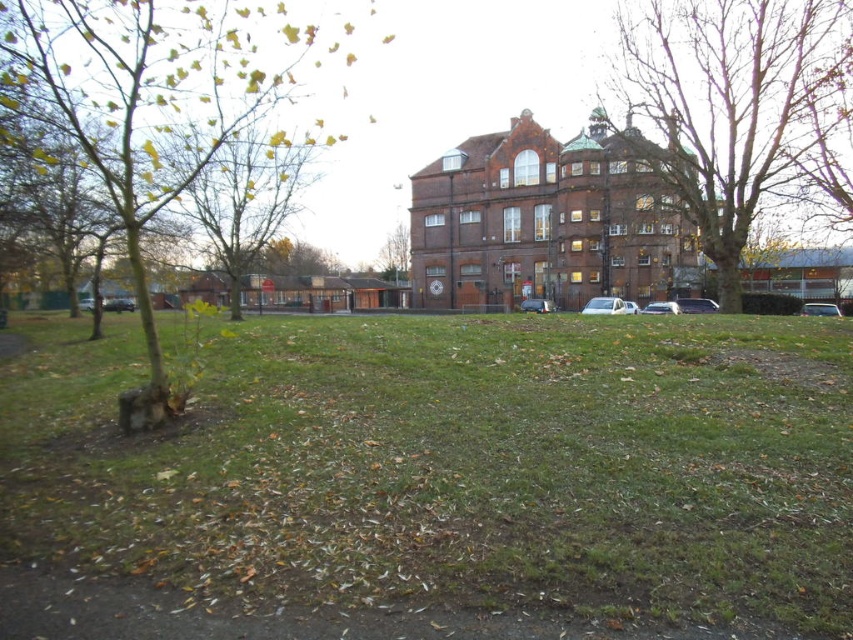
Question: Which object is positioned farthest from the silver metallic car at center?

Choices:
 (A) white matte car at lower right
 (B) metallic silver car at lower left

Answer: (B)

Question: Can you confirm if green leafy tree at left is smaller than metallic silver car at lower left?

Choices:
 (A) yes
 (B) no

Answer: (B)

Question: Is yellow-green leaves at upper left to the left of white matte car at center from the viewer's perspective?

Choices:
 (A) yes
 (B) no

Answer: (A)

Question: Among these points, which one is farthest from the camera?

Choices:
 (A) (601, 308)
 (B) (682, 308)

Answer: (B)

Question: Does metallic silver car at center appear on the right side of white matte car at lower right?

Choices:
 (A) yes
 (B) no

Answer: (B)

Question: Which of the following is the closest to the observer?

Choices:
 (A) (808, 307)
 (B) (397, 282)
 (C) (643, 90)

Answer: (A)